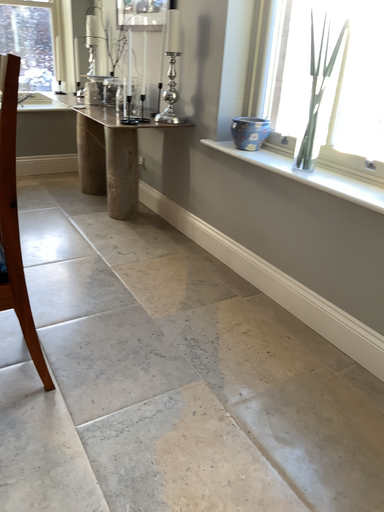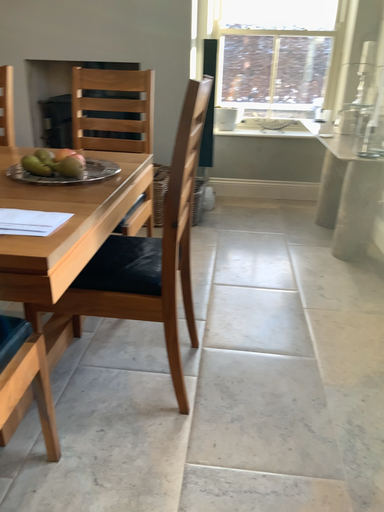
Question: How did the camera likely rotate when shooting the video?

Choices:
 (A) rotated upward
 (B) rotated downward

Answer: (A)